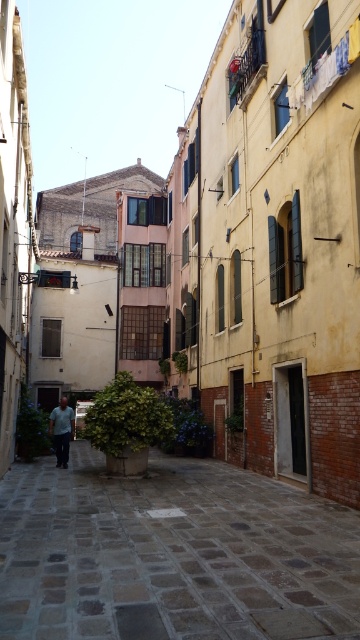
You are a delivery person carrying a light green shirt at center and need to walk along the stone paved path at center in the narrow alleyway. Can you walk through the path without the shirt touching the sides of the path?

The stone paved path at center is wider than the light green shirt at center, so yes, you can walk through the path without the shirt touching the sides of the path.

You are a tourist walking through the historic alleyway and want to place a small backpack on the ground. The backpack is the same size as the light green shirt at center. Can you fit it on the stone paved path at center without overlapping?

The stone paved path at center is smaller than the light green shirt at center. Since the backpack is the same size as the light green shirt at center, it will not fit on the stone paved path at center as the path is smaller.